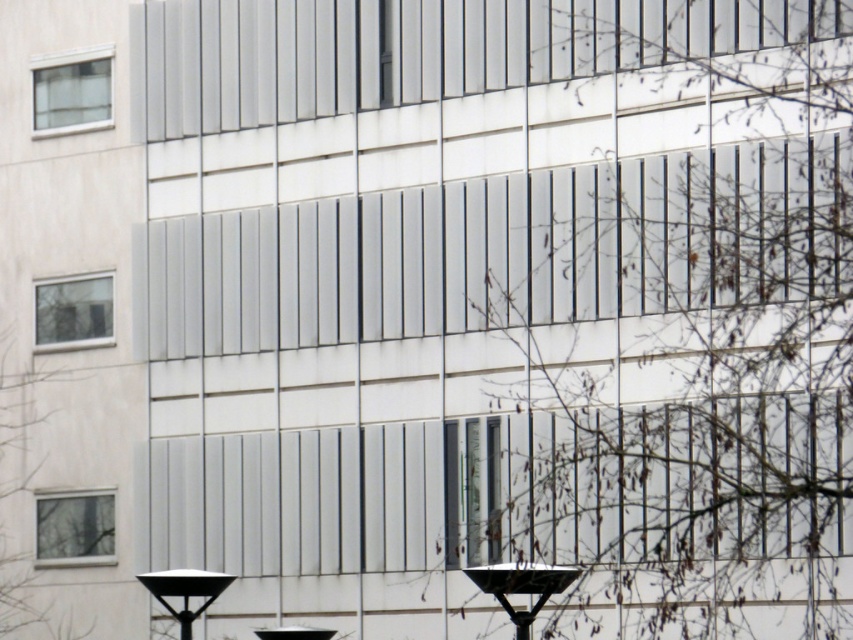
Between clear glass window at left and black plastic streetlight at lower center, which one appears on the left side from the viewer's perspective?

From the viewer's perspective, clear glass window at left appears more on the left side.

Who is shorter, clear glass window at left or black plastic streetlight at lower center?

black plastic streetlight at lower center is shorter.

Find the location of a particular element. This screenshot has height=640, width=853. clear glass window at left is located at coordinates (73, 312).

Which is below, clear glass window at upper left or clear glass window at left?

clear glass window at left is lower down.

Between point (73, 70) and point (36, 284), which one is positioned behind?

The point (36, 284) is more distant.

Find the location of `clear glass window at upper left`. clear glass window at upper left is located at coordinates (71, 92).

Is clear glass window at upper left above black plastic streetlight at lower center?

Correct, clear glass window at upper left is located above black plastic streetlight at lower center.

Between clear glass window at upper left and black plastic streetlight at lower center, which one appears on the right side from the viewer's perspective?

black plastic streetlight at lower center

Is point (102, 116) behind point (531, 577)?

That is True.

Locate an element on the screen. The height and width of the screenshot is (640, 853). clear glass window at upper left is located at coordinates 71,92.